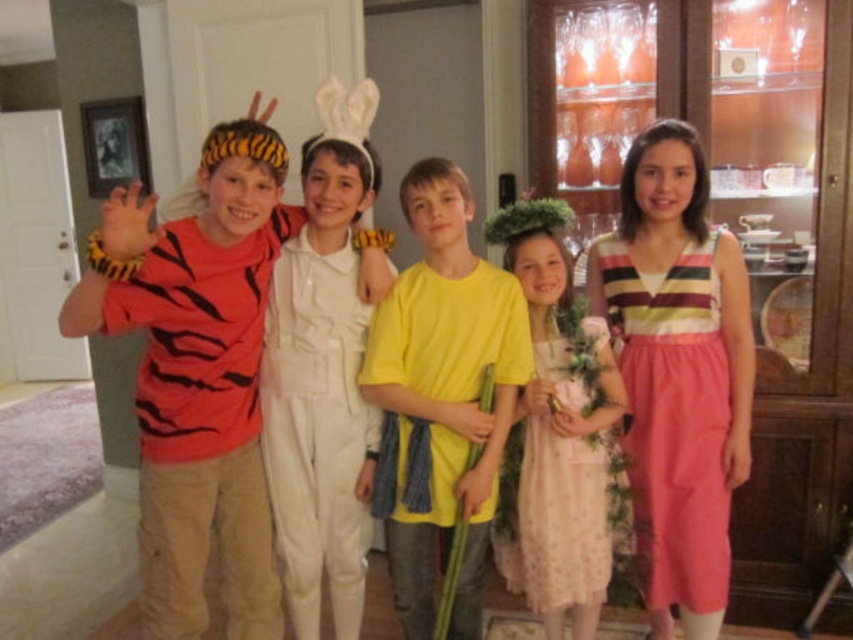
Is point (341, 560) positioned after point (672, 429)?

Yes, it is.

Is white cotton jumpsuit at center taller than pink cotton dress at right?

Correct, white cotton jumpsuit at center is much taller as pink cotton dress at right.

At what (x,y) coordinates should I click in order to perform the action: click on white cotton jumpsuit at center. Please return your answer as a coordinate pair (x, y). Looking at the image, I should click on (318, 428).

Which is more to the left, tiger-striped fabric shirt at left or white cotton jumpsuit at center?

From the viewer's perspective, tiger-striped fabric shirt at left appears more on the left side.

Is tiger-striped fabric shirt at left wider than white cotton jumpsuit at center?

Yes.

Between point (223, 417) and point (343, 408), which one is positioned in front?

Point (223, 417) is in front.

What are the coordinates of `tiger-striped fabric shirt at left` in the screenshot? It's located at (202, 422).

What do you see at coordinates (202, 422) in the screenshot? This screenshot has width=853, height=640. I see `tiger-striped fabric shirt at left` at bounding box center [202, 422].

Consider the image. Can you confirm if tiger-striped fabric shirt at left is positioned to the left of pink cotton dress at right?

Yes, tiger-striped fabric shirt at left is to the left of pink cotton dress at right.

This screenshot has height=640, width=853. In order to click on tiger-striped fabric shirt at left in this screenshot , I will do `click(202, 422)`.